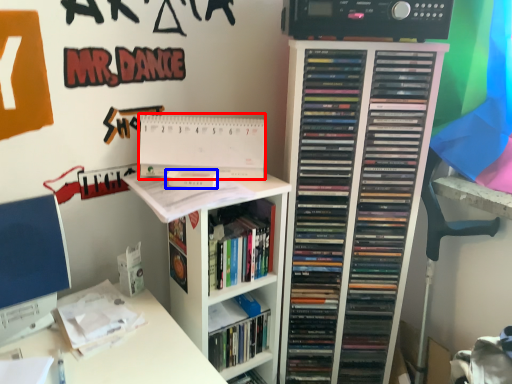
Question: Which of the following is the farthest to the observer, paperback book (highlighted by a red box) or paperback book (highlighted by a blue box)?

Choices:
 (A) paperback book
 (B) paperback book

Answer: (A)